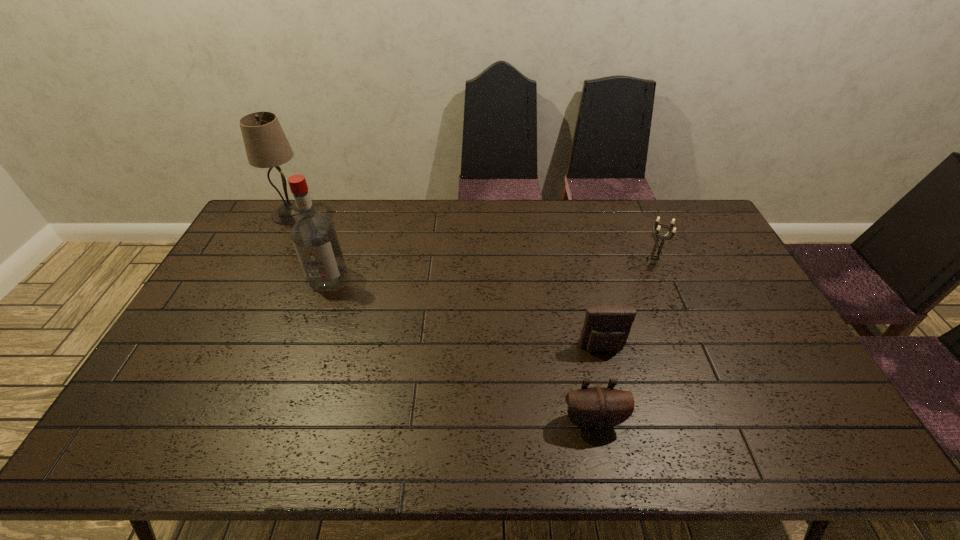
Where is `object at the far edge`? This screenshot has width=960, height=540. object at the far edge is located at coordinates (266, 145).

Locate an element on the screen. This screenshot has height=540, width=960. object located in the near edge section of the desktop is located at coordinates (597, 408).

You are a GUI agent. You are given a task and a screenshot of the screen. Output one action in this format:
    pyautogui.click(x=<x>, y=<y>)
    Task: Click on the object at the left edge
    The image size is (960, 540).
    Given the screenshot: What is the action you would take?
    266,145

Where is `object present at the far left corner`? object present at the far left corner is located at coordinates (266, 145).

I want to click on free space at the far edge, so click(x=407, y=202).

Image resolution: width=960 pixels, height=540 pixels. Find the location of `vacant space at the near edge of the desktop`. vacant space at the near edge of the desktop is located at coordinates (220, 458).

Find the location of a particular element. This screenshot has height=540, width=960. free space at the left edge is located at coordinates (270, 245).

Image resolution: width=960 pixels, height=540 pixels. Find the location of `vacant space at the right edge of the desktop`. vacant space at the right edge of the desktop is located at coordinates (724, 316).

This screenshot has width=960, height=540. In order to click on free space at the far left corner of the desktop in this screenshot , I will do `click(259, 233)`.

The image size is (960, 540). Find the location of `vacant area at the far right corner of the desktop`. vacant area at the far right corner of the desktop is located at coordinates (664, 204).